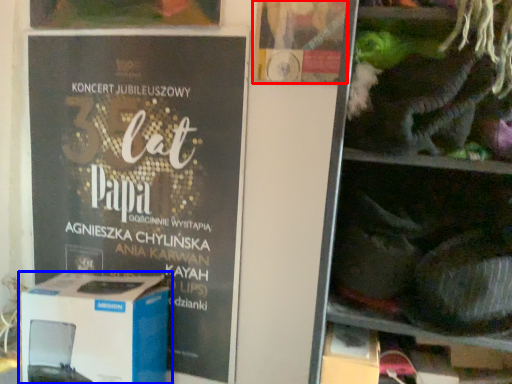
Question: Among these objects, which one is farthest to the camera, flyer (highlighted by a red box) or box (highlighted by a blue box)?

Choices:
 (A) flyer
 (B) box

Answer: (B)